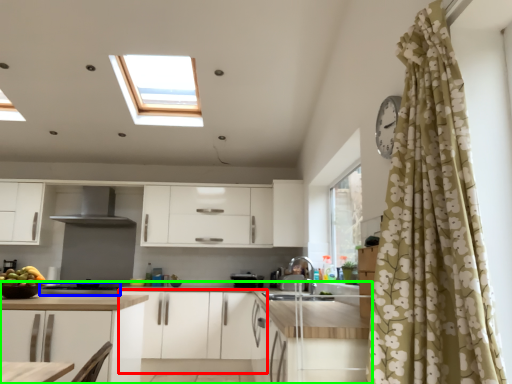
Question: Based on their relative distances, which object is farther from cabinetry (highlighted by a red box)? Choose from appliance (highlighted by a blue box) and countertop (highlighted by a green box).

Choices:
 (A) appliance
 (B) countertop

Answer: (A)